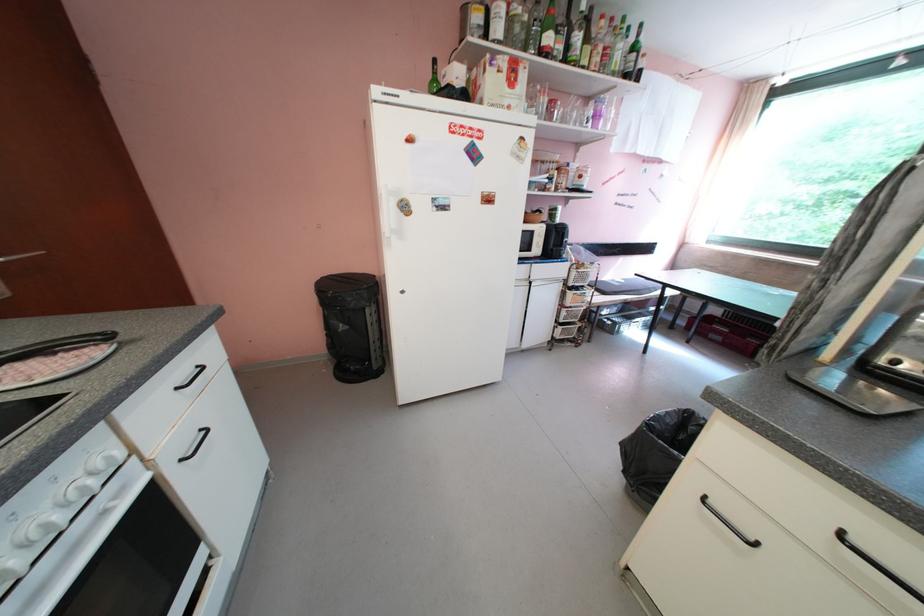
What do you see at coordinates (387, 213) in the screenshot? I see `a refrigerator door handle` at bounding box center [387, 213].